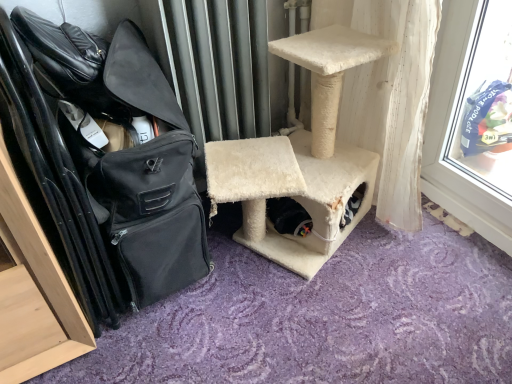
Question: From a real-world perspective, relative to beige carpeted cat tree at center, is black fabric shoulder bag at left vertically above or below?

Choices:
 (A) above
 (B) below

Answer: (A)

Question: From their relative heights in the image, would you say black fabric shoulder bag at left is taller or shorter than beige carpeted cat tree at center?

Choices:
 (A) short
 (B) tall

Answer: (B)

Question: Is black fabric shoulder bag at left bigger or smaller than beige carpeted cat tree at center?

Choices:
 (A) small
 (B) big

Answer: (A)

Question: In terms of width, does beige carpeted cat tree at center look wider or thinner when compared to black fabric shoulder bag at left?

Choices:
 (A) wide
 (B) thin

Answer: (A)

Question: From a real-world perspective, relative to black fabric shoulder bag at left, is beige carpeted cat tree at center vertically above or below?

Choices:
 (A) below
 (B) above

Answer: (A)

Question: Visually, is beige carpeted cat tree at center positioned to the left or to the right of black fabric shoulder bag at left?

Choices:
 (A) left
 (B) right

Answer: (B)

Question: Relative to black fabric shoulder bag at left, is beige carpeted cat tree at center in front or behind?

Choices:
 (A) front
 (B) behind

Answer: (B)